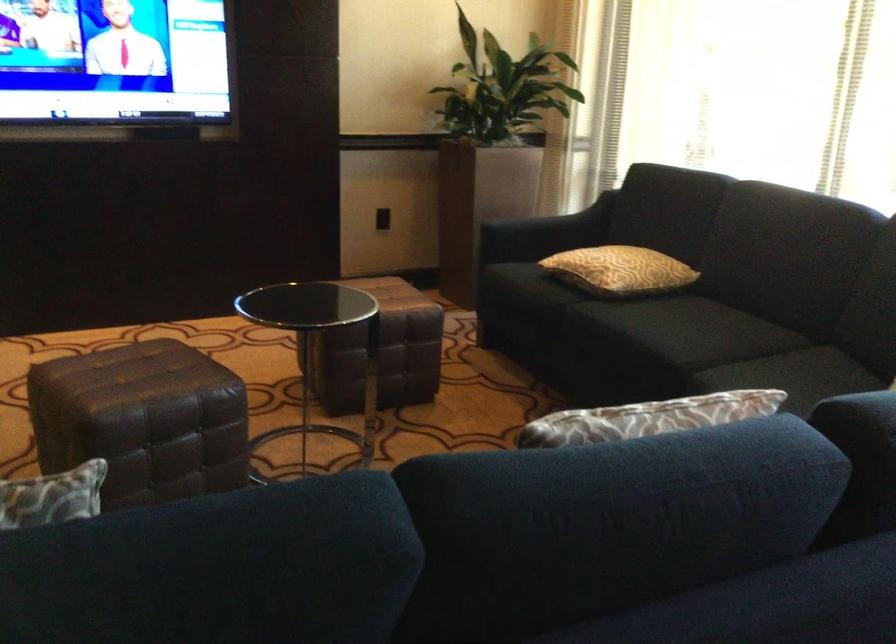
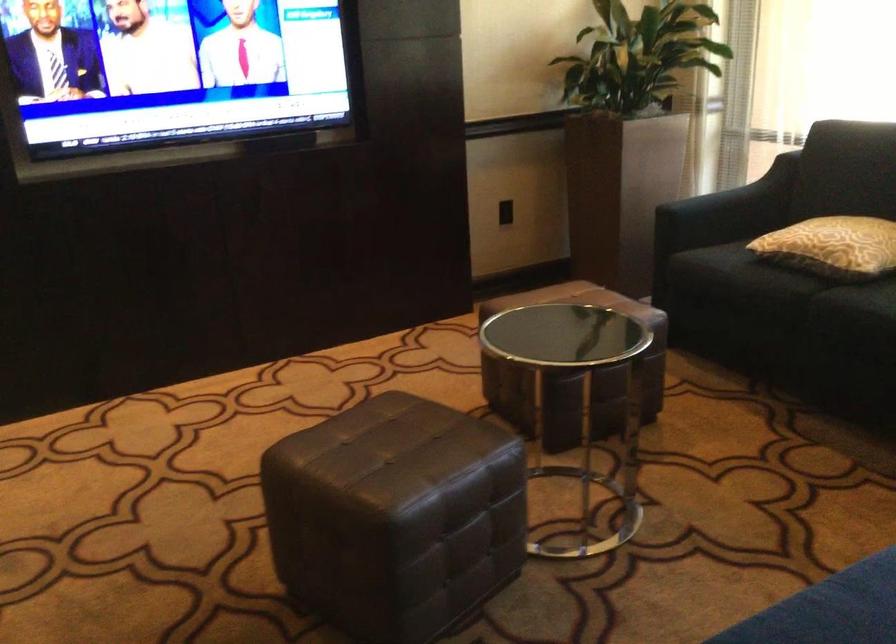
Find the pixel in the second image that matches [541,295] in the first image.

(767, 283)